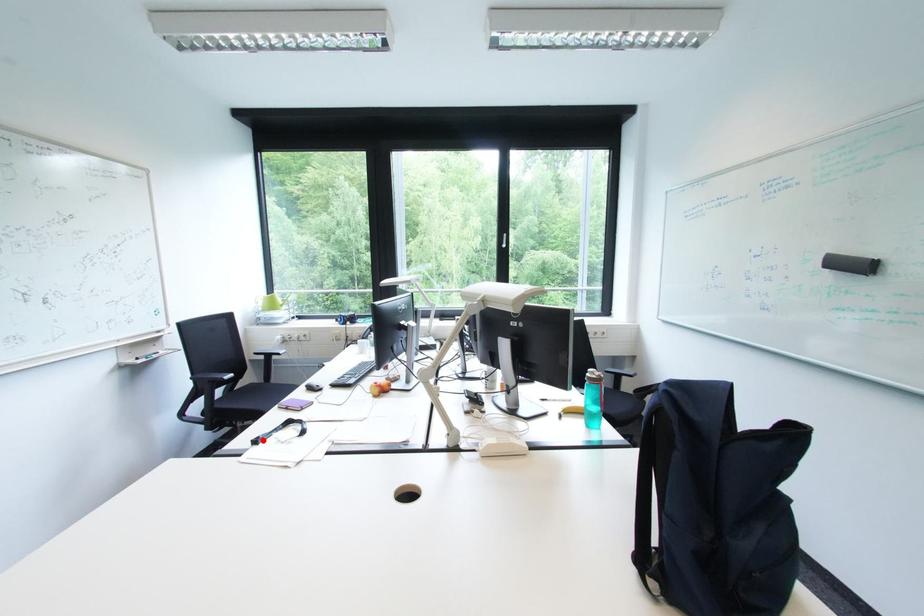
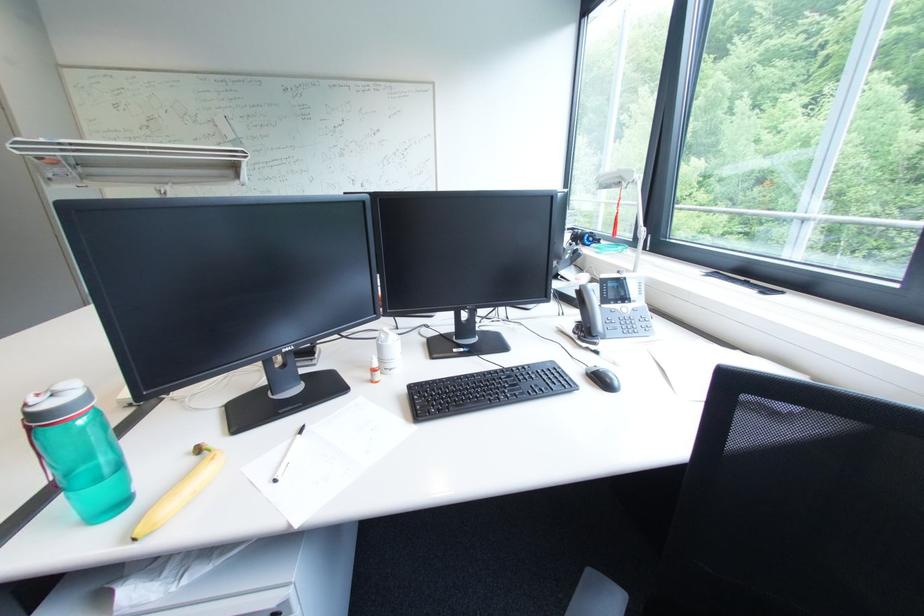
Question: I am providing you with two images of the same scene from different viewpoints. A red point is marked on the first image. Can you still see the location of the red point in image 2?

Choices:
 (A) Yes
 (B) No

Answer: (B)